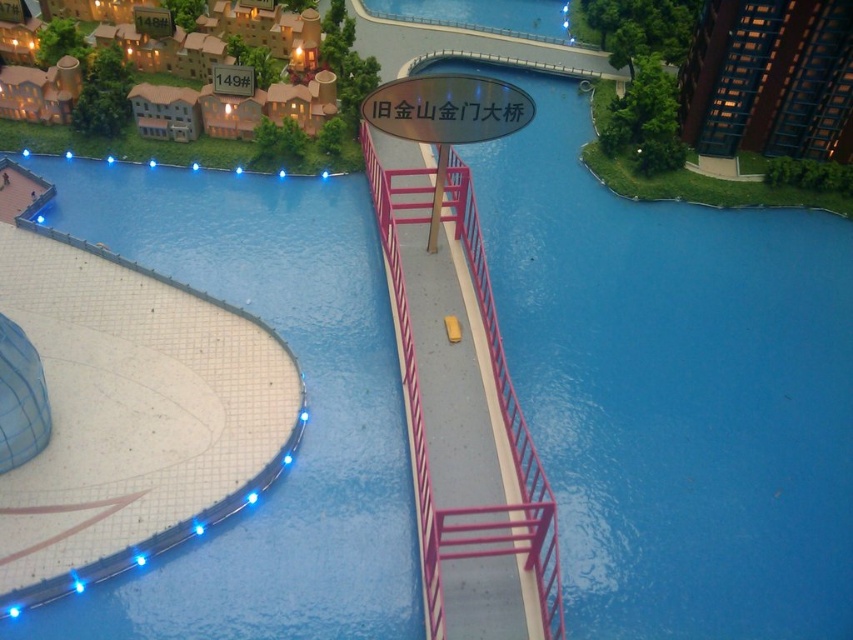
You are a model city inspector checking the structural integrity of the miniature city. You notice the blue glossy pool at lower left and the metallic pink railing at center. Which object is located below the other?

The blue glossy pool at lower left is positioned under the metallic pink railing at center.

You are a model city planner who needs to install a new decorative light between the blue glossy pool at lower left and the metallic pink railing at center. The light requires a minimum of 10 meters of space between them to function properly. Based on the current distance, will the light work correctly?

The blue glossy pool at lower left is 9.71 meters from the metallic pink railing at center. Since the required minimum distance is 10 meters, the light will not function properly as the current distance is insufficient.

You are a tiny robot navigating the miniature city model. You need to move from your current position to the point marked as point (x=697, y=113). However, there is an obstacle at point (x=303, y=269). Will you encounter this obstacle before reaching your destination?

Yes, you will encounter the obstacle at point (x=303, y=269) before reaching point (x=697, y=113) because point (x=303, y=269) is in front of point (x=697, y=113).